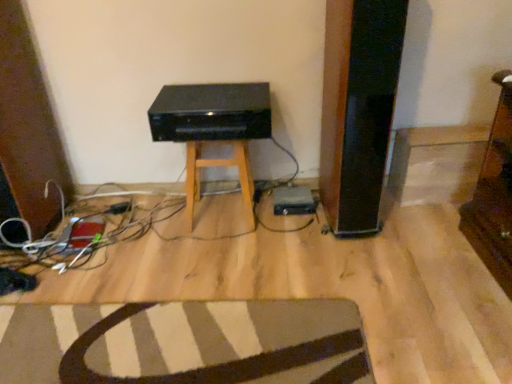
Locate an element on the screen. The height and width of the screenshot is (384, 512). vacant area that is in front of black matte stool at center is located at coordinates (217, 251).